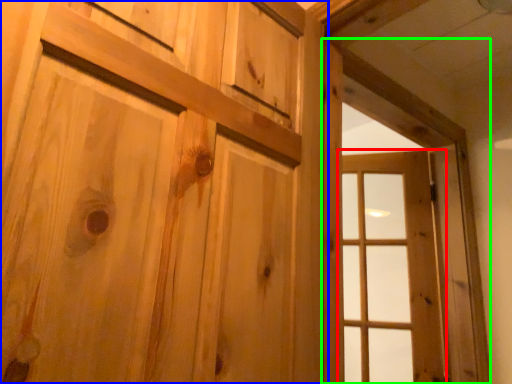
Question: Which object is the farthest from window (highlighted by a red box)? Choose among these: door (highlighted by a blue box) or window frame (highlighted by a green box).

Choices:
 (A) door
 (B) window frame

Answer: (A)